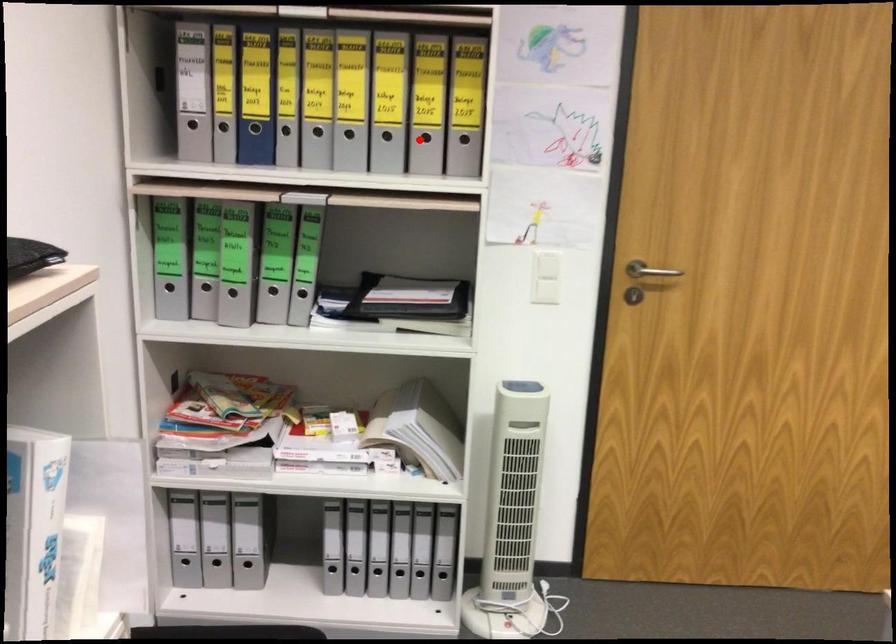
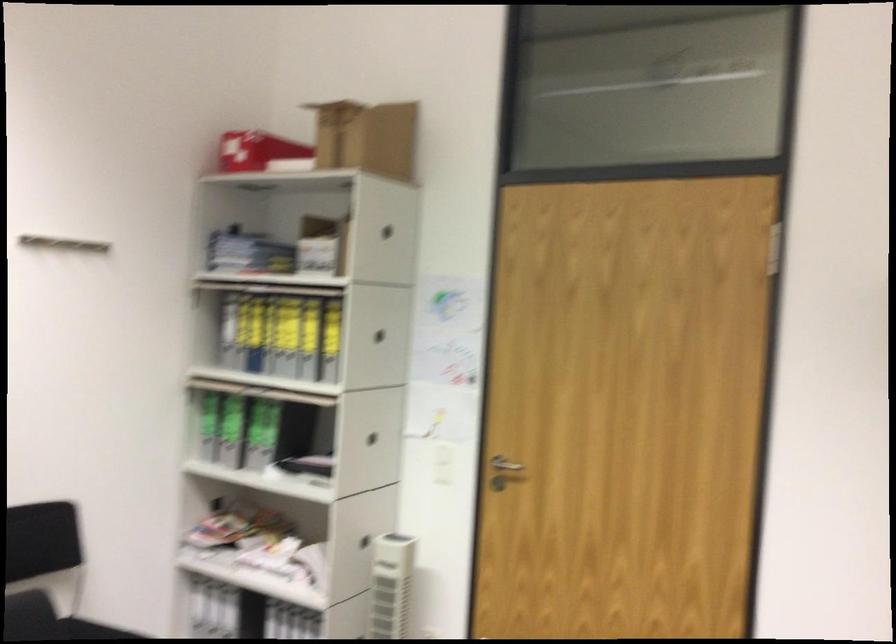
Question: I am providing you with two images of the same scene from different viewpoints. Image1 has a red point marked. In image2, the corresponding 3D location appears at what relative position? Reply with the corresponding letter.

Choices:
 (A) Closer
 (B) Farther

Answer: (B)